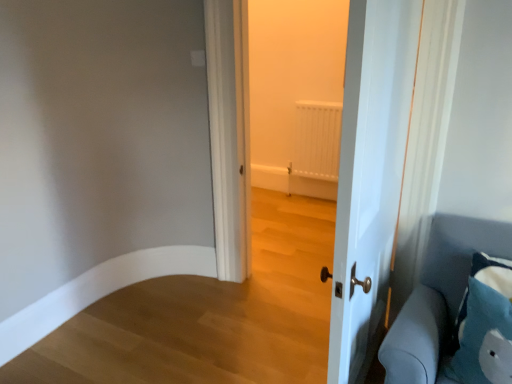
What do you see at coordinates (451, 332) in the screenshot?
I see `blue fabric pillow at lower right` at bounding box center [451, 332].

The height and width of the screenshot is (384, 512). In order to click on blue fabric pillow at lower right in this screenshot , I will do `click(493, 272)`.

Looking at this image, from the image's perspective, which one is positioned higher, blue fabric pillow at lower right or blue fabric pillow at lower right?

blue fabric pillow at lower right, from the image's perspective.

Can you confirm if blue fabric pillow at lower right is bigger than blue fabric pillow at lower right?

Correct, blue fabric pillow at lower right is larger in size than blue fabric pillow at lower right.

Is blue fabric pillow at lower right at the back of blue fabric pillow at lower right?

Yes, blue fabric pillow at lower right is facing away from blue fabric pillow at lower right.

I want to click on door above the blue fabric pillow at lower right (from a real-world perspective), so click(x=370, y=175).

Considering the relative sizes of blue fabric pillow at lower right and white glossy door at center in the image provided, is blue fabric pillow at lower right wider than white glossy door at center?

Indeed, blue fabric pillow at lower right has a greater width compared to white glossy door at center.

Between blue fabric pillow at lower right and white glossy door at center, which one is positioned in front?

Positioned in front is white glossy door at center.

Which of these two, blue fabric pillow at lower right or white glossy door at center, stands shorter?

blue fabric pillow at lower right.

In the image, is blue fabric pillow at lower right positioned in front of or behind white glossy door at center?

blue fabric pillow at lower right is behind white glossy door at center.

Which of these two, blue fabric pillow at lower right or white glossy door at center, is wider?

Wider between the two is blue fabric pillow at lower right.

This screenshot has height=384, width=512. I want to click on pillow on the right of white glossy door at center, so click(493, 272).

Does point (489, 259) appear closer or farther from the camera than point (346, 309)?

Point (489, 259) is farther from the camera than point (346, 309).

Is white glossy door at center situated inside blue fabric pillow at lower right or outside?

white glossy door at center is spatially situated outside blue fabric pillow at lower right.

Is white glossy door at center facing towards blue fabric pillow at lower right?

Yes, white glossy door at center is oriented towards blue fabric pillow at lower right.

Which is in front, white glossy door at center or blue fabric pillow at lower right?

white glossy door at center.

What's the angular difference between white glossy door at center and blue fabric pillow at lower right's facing directions?

They differ by 87 degrees in their facing directions.

This screenshot has width=512, height=384. I want to click on pillow that is behind the blue fabric pillow at lower right, so click(x=493, y=272).

Could you tell me if blue fabric pillow at lower right is facing blue fabric pillow at lower right?

Yes, blue fabric pillow at lower right faces towards blue fabric pillow at lower right.

From a real-world perspective, is blue fabric pillow at lower right below blue fabric pillow at lower right?

Actually, blue fabric pillow at lower right is physically above blue fabric pillow at lower right in the real world.

From the picture: Is blue fabric pillow at lower right far from blue fabric pillow at lower right?

They are positioned close to each other.

Which object is further away from the camera taking this photo, white glossy door at center or blue fabric pillow at lower right?

Positioned behind is blue fabric pillow at lower right.

Considering the positions of objects white glossy door at center and blue fabric pillow at lower right in the image provided, who is more to the right, white glossy door at center or blue fabric pillow at lower right?

blue fabric pillow at lower right is more to the right.

Is point (364, 56) less distant than point (406, 361)?

Yes, it is in front of point (406, 361).

The image size is (512, 384). Find the location of `pillow behind the blue fabric pillow at lower right`. pillow behind the blue fabric pillow at lower right is located at coordinates (493, 272).

Where is `furniture below the white glossy door at center (from the image's perspective)`? The width and height of the screenshot is (512, 384). furniture below the white glossy door at center (from the image's perspective) is located at coordinates (451, 332).

From the image, which object appears to be nearer to blue fabric pillow at lower right, blue fabric pillow at lower right or white glossy door at center?

Among the two, blue fabric pillow at lower right is located nearer to blue fabric pillow at lower right.

Looking at this image, which object lies nearer to the anchor point blue fabric pillow at lower right, blue fabric pillow at lower right or white glossy door at center?

Among the two, blue fabric pillow at lower right is located nearer to blue fabric pillow at lower right.

When comparing their distances from white glossy door at center, does blue fabric pillow at lower right or blue fabric pillow at lower right seem further?

Based on the image, blue fabric pillow at lower right appears to be further to white glossy door at center.

When comparing their distances from white glossy door at center, does blue fabric pillow at lower right or blue fabric pillow at lower right seem closer?

blue fabric pillow at lower right is closer to white glossy door at center.

When comparing their distances from blue fabric pillow at lower right, does white glossy door at center or blue fabric pillow at lower right seem further?

Among the two, white glossy door at center is located further to blue fabric pillow at lower right.

Looking at this image, based on their spatial positions, is white glossy door at center or blue fabric pillow at lower right further from blue fabric pillow at lower right?

white glossy door at center.

Locate an element on the screen. This screenshot has height=384, width=512. furniture located between white glossy door at center and blue fabric pillow at lower right in the depth direction is located at coordinates (451, 332).